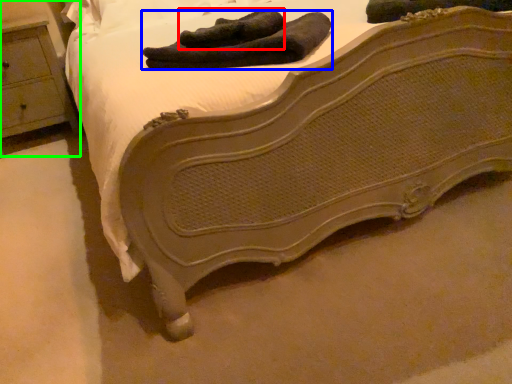
Question: Which is nearer to the footwear (highlighted by a red box)? footwear (highlighted by a blue box) or nightstand (highlighted by a green box).

Choices:
 (A) footwear
 (B) nightstand

Answer: (A)